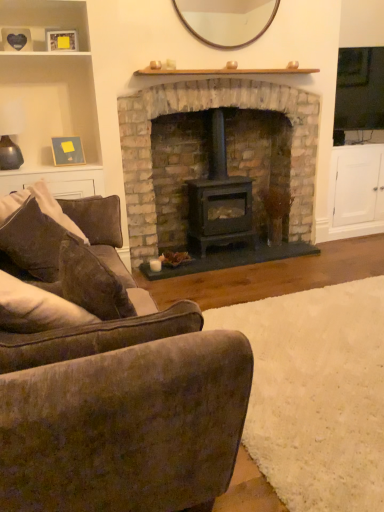
Question: Is wooden picture frame at upper left, which appears as the second picture frame when ordered from the bottom, surrounding wooden shelf at upper left?

Choices:
 (A) no
 (B) yes

Answer: (A)

Question: Is wooden picture frame at upper left, which appears as the second picture frame when ordered from the bottom, positioned before wooden shelf at upper left?

Choices:
 (A) yes
 (B) no

Answer: (B)

Question: Is wooden picture frame at upper left, acting as the 1th picture frame starting from the front, positioned far away from wooden shelf at upper left?

Choices:
 (A) no
 (B) yes

Answer: (A)

Question: Can you confirm if wooden picture frame at upper left, arranged as the 2th picture frame when viewed from the back, is positioned to the right of wooden shelf at upper left?

Choices:
 (A) no
 (B) yes

Answer: (B)

Question: Is wooden picture frame at upper left, which appears as the second picture frame when ordered from the bottom, positioned beyond the bounds of wooden shelf at upper left?

Choices:
 (A) no
 (B) yes

Answer: (A)

Question: Is wooden picture frame at upper left, acting as the 1th picture frame starting from the front, bigger than wooden shelf at upper left?

Choices:
 (A) no
 (B) yes

Answer: (A)

Question: Is brown fabric couch at center positioned beyond the bounds of black matte wood burning stove at center?

Choices:
 (A) yes
 (B) no

Answer: (A)

Question: Can you confirm if brown fabric couch at center is bigger than black matte wood burning stove at center?

Choices:
 (A) yes
 (B) no

Answer: (A)

Question: Is brown fabric couch at center thinner than black matte wood burning stove at center?

Choices:
 (A) no
 (B) yes

Answer: (A)

Question: Does brown fabric couch at center appear on the left side of black matte wood burning stove at center?

Choices:
 (A) no
 (B) yes

Answer: (B)

Question: Does brown fabric couch at center have a lesser height compared to black matte wood burning stove at center?

Choices:
 (A) no
 (B) yes

Answer: (B)

Question: Is black matte wood burning stove at center a part of brown fabric couch at center?

Choices:
 (A) yes
 (B) no

Answer: (B)

Question: From a real-world perspective, is velvety brown armchair at lower left below wooden mirror at upper center?

Choices:
 (A) no
 (B) yes

Answer: (B)